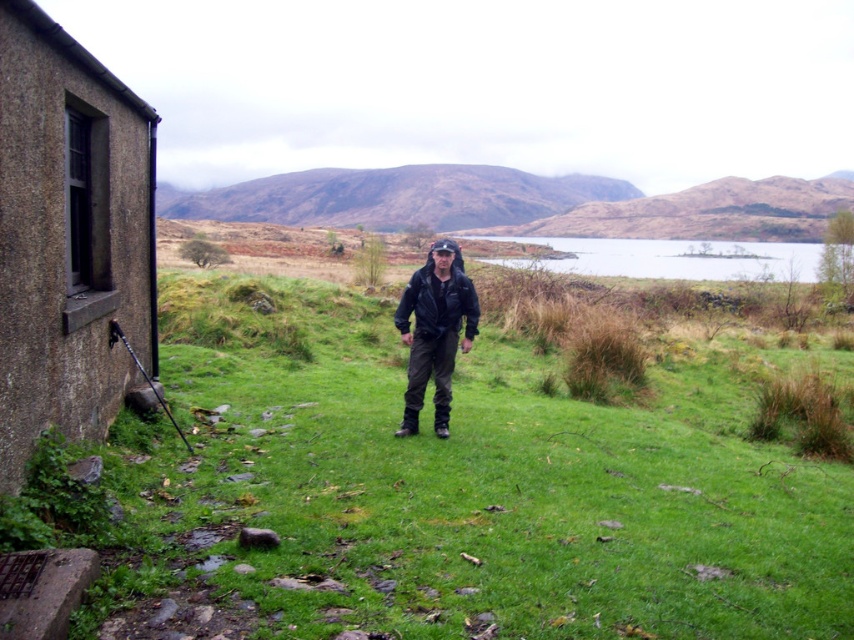
Which is above, green grassy at center or black leather jacket at center?

black leather jacket at center

Between green grassy at center and black leather jacket at center, which one has more height?

green grassy at center is taller.

This screenshot has width=854, height=640. Find the location of `green grassy at center`. green grassy at center is located at coordinates (449, 493).

Is point (139, 216) behind point (466, 276)?

Yes.

Image resolution: width=854 pixels, height=640 pixels. I want to click on brown textured stone hut at left, so click(68, 236).

Measure the distance between brown textured stone hut at left and camera.

They are 3.92 meters apart.

Can you confirm if brown textured stone hut at left is bigger than clear water at center?

No.

The image size is (854, 640). I want to click on brown textured stone hut at left, so click(68, 236).